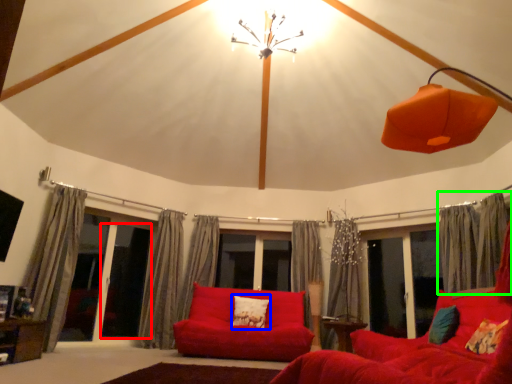
Question: Which object is the farthest from screen door (highlighted by a red box)? Choose among these: pillow (highlighted by a blue box) or curtain (highlighted by a green box).

Choices:
 (A) pillow
 (B) curtain

Answer: (B)